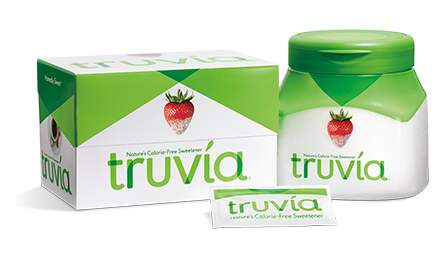
This screenshot has width=445, height=258. In order to click on bottle in this screenshot , I will do `click(369, 116)`.